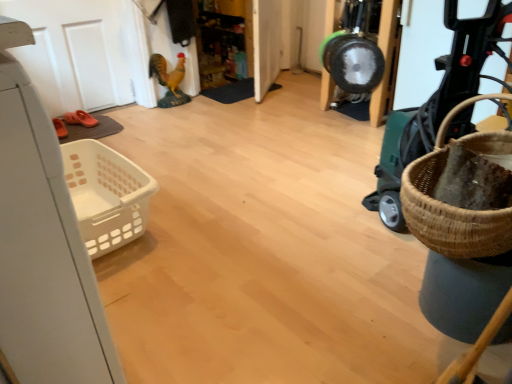
Find the location of a particular element. The height and width of the screenshot is (384, 512). vacant point to the left of green plastic baby carriage at right is located at coordinates click(325, 224).